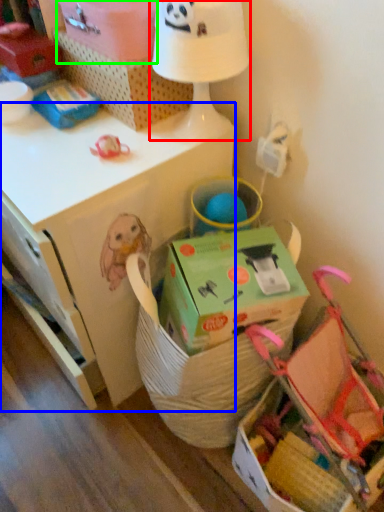
Question: Based on their relative distances, which object is nearer to table lamp (highlighted by a red box)? Choose from desk (highlighted by a blue box) and cardboard box (highlighted by a green box).

Choices:
 (A) desk
 (B) cardboard box

Answer: (B)